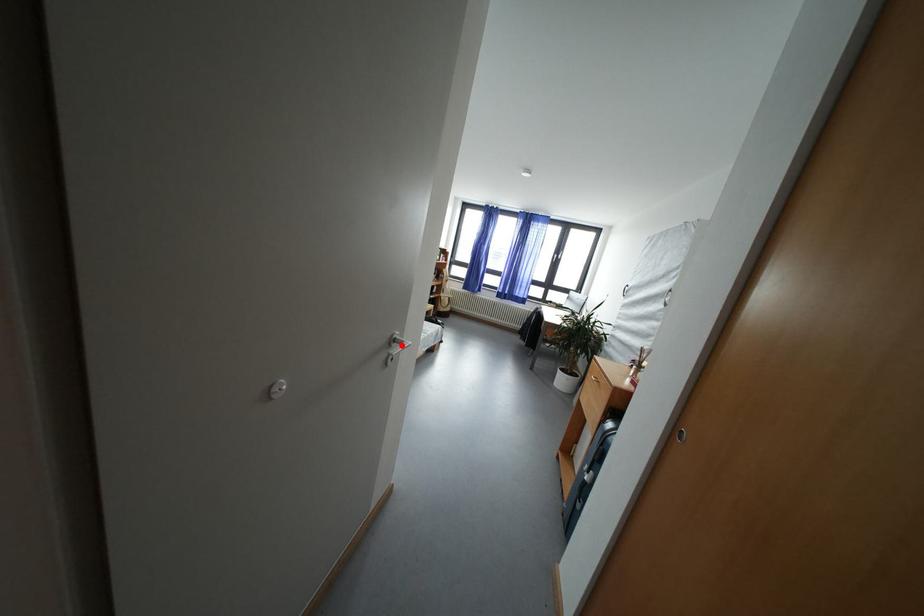
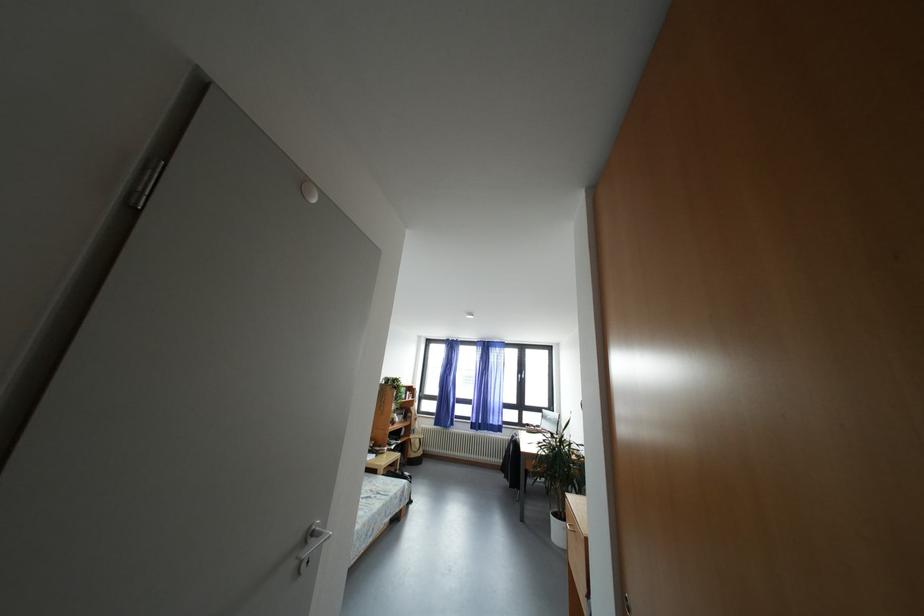
Question: I am providing you with two images of the same scene from different viewpoints. A red point is shown in image1. For the corresponding object point in image2, is it positioned nearer or farther from the camera?

Choices:
 (A) Nearer
 (B) Farther

Answer: (B)